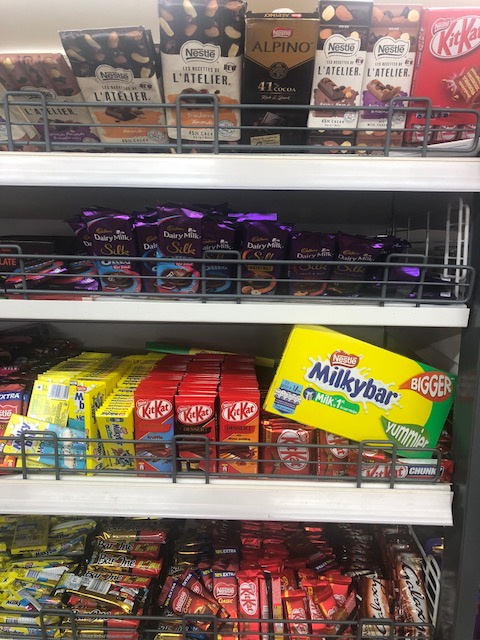
The height and width of the screenshot is (640, 480). I want to click on back wall, so click(25, 6).